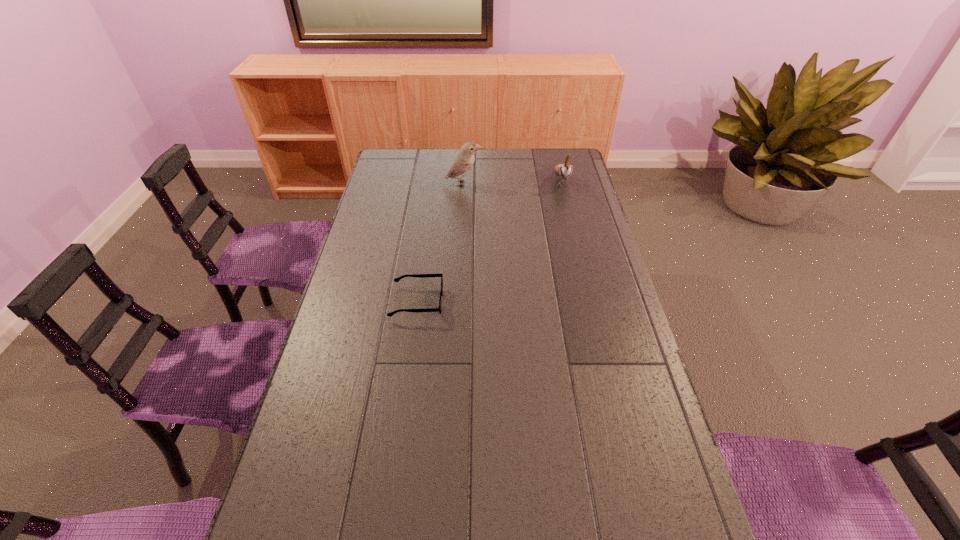
Locate an element on the screen. free area in between the shortest object and the rightmost object is located at coordinates (489, 241).

The width and height of the screenshot is (960, 540). Find the location of `empty space that is in between the left bird and the shortest object`. empty space that is in between the left bird and the shortest object is located at coordinates (440, 243).

You are a GUI agent. You are given a task and a screenshot of the screen. Output one action in this format:
    pyautogui.click(x=<x>, y=<y>)
    Task: Click on the unoccupied area between the left bird and the spectacles
    The width and height of the screenshot is (960, 540).
    Given the screenshot: What is the action you would take?
    pyautogui.click(x=440, y=243)

This screenshot has width=960, height=540. In order to click on object that can be found as the second closest to the left bird in this screenshot , I will do `click(398, 279)`.

Image resolution: width=960 pixels, height=540 pixels. Identify the location of object identified as the closest to the left bird. click(x=565, y=170).

Where is `vacant region that satisfies the following two spatial constraints: 1. at the face of the right bird; 2. at the face of the left bird`? vacant region that satisfies the following two spatial constraints: 1. at the face of the right bird; 2. at the face of the left bird is located at coordinates (563, 184).

Where is `vacant area that satisfies the following two spatial constraints: 1. at the face of the right bird; 2. at the face of the left bird`? vacant area that satisfies the following two spatial constraints: 1. at the face of the right bird; 2. at the face of the left bird is located at coordinates (563, 184).

The height and width of the screenshot is (540, 960). I want to click on vacant area in the image that satisfies the following two spatial constraints: 1. at the face of the rightmost object; 2. on the arms of the nearest object, so click(x=591, y=302).

Where is `free space that satisfies the following two spatial constraints: 1. at the face of the rightmost object; 2. on the arms of the shortest object`? This screenshot has height=540, width=960. free space that satisfies the following two spatial constraints: 1. at the face of the rightmost object; 2. on the arms of the shortest object is located at coordinates (591, 302).

Image resolution: width=960 pixels, height=540 pixels. I want to click on free space that satisfies the following two spatial constraints: 1. at the face of the rightmost object; 2. at the face of the left bird, so click(x=563, y=184).